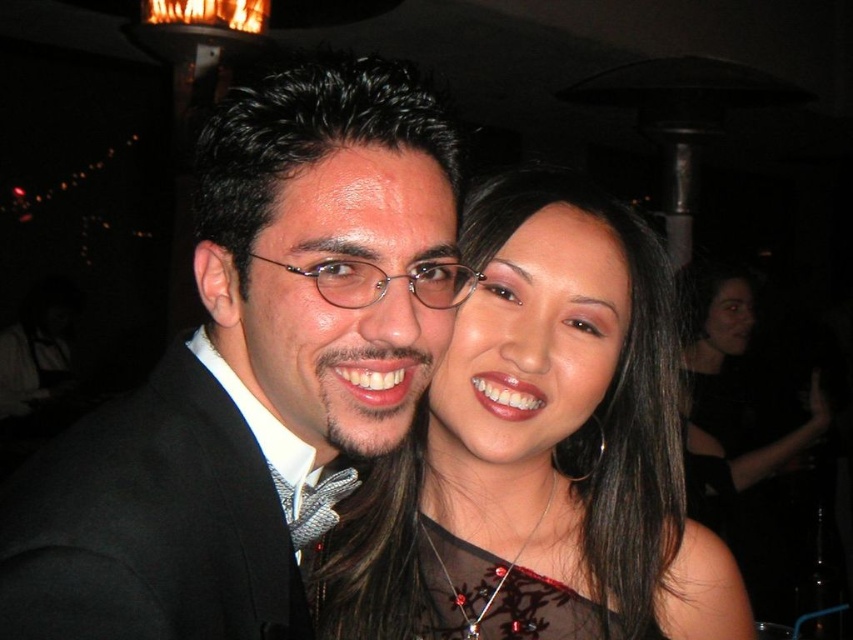
You are a photographer at a party and need to adjust the lighting to ensure both the satin black dress at center and the black satin dress at right are well lit. Since the dresses are positioned differently, which dress is higher up in the frame?

The satin black dress at center is higher up in the frame than the black satin dress at right, so you should adjust the lighting to account for its position.

You are taking a photo of two people at an event. The camera you are using has a minimum focus distance of 30 inches. There is a point at coordinates point (602, 545) in the image. Can the camera focus on this point?

The point (602, 545) is 28.18 inches away from the camera, which is less than the minimum focus distance of 30 inches. Therefore, the camera cannot focus on this point.

You are at a party and need to decide which item is taller between the satin black dress at center and the black wool suit at left. Based on the scene description, which one is taller?

The satin black dress at center is taller than the black wool suit at left according to the description.